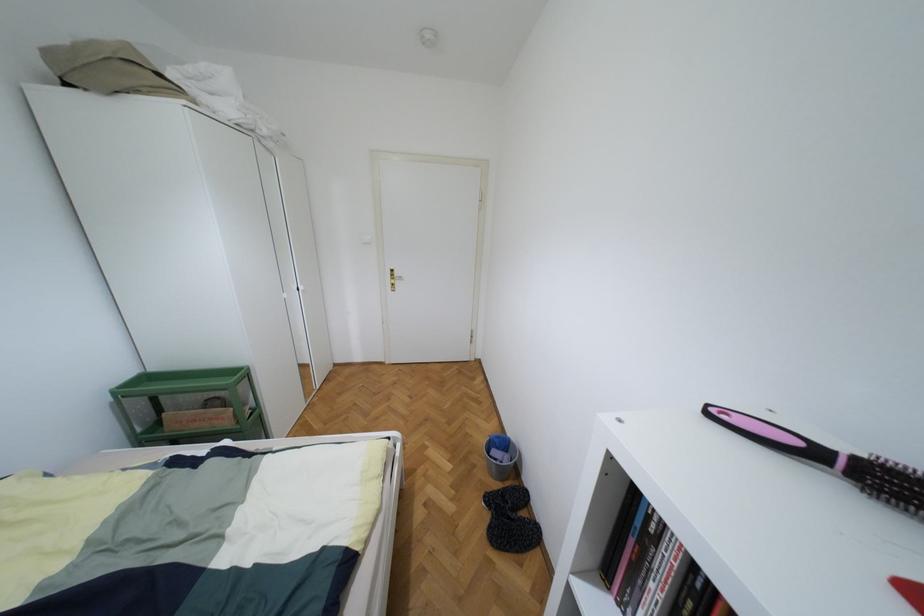
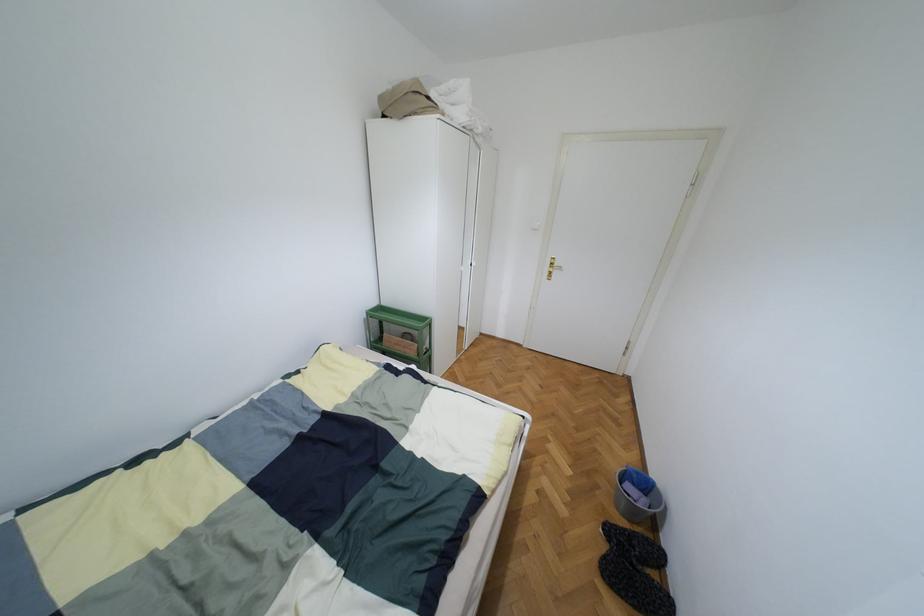
Find the pixel in the second image that matches point (146, 378) in the first image.

(380, 307)